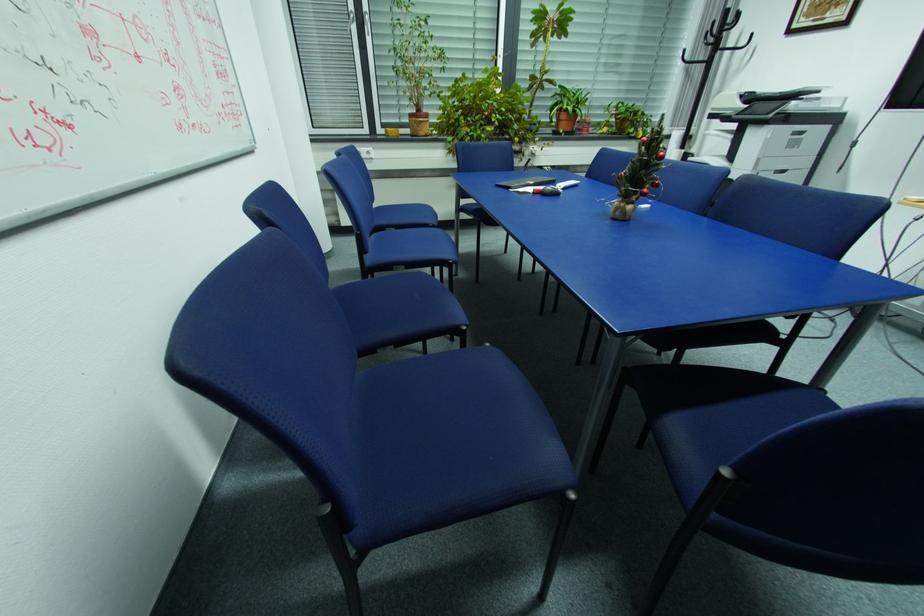
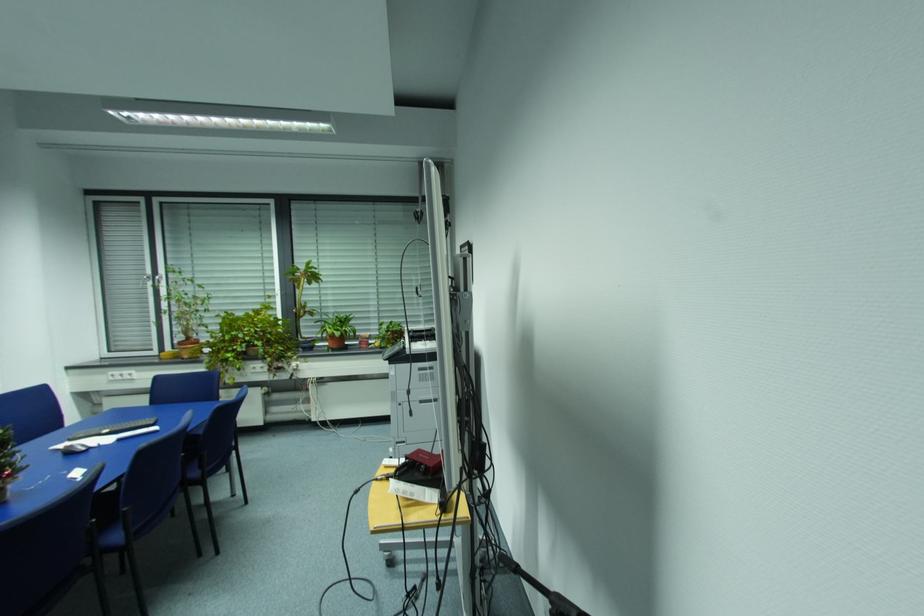
Question: Which direction would the cameraman need to move to produce the second image? Reply with the corresponding letter.

Choices:
 (A) Left
 (B) Right
 (C) Forward
 (D) Backward

Answer: (B)